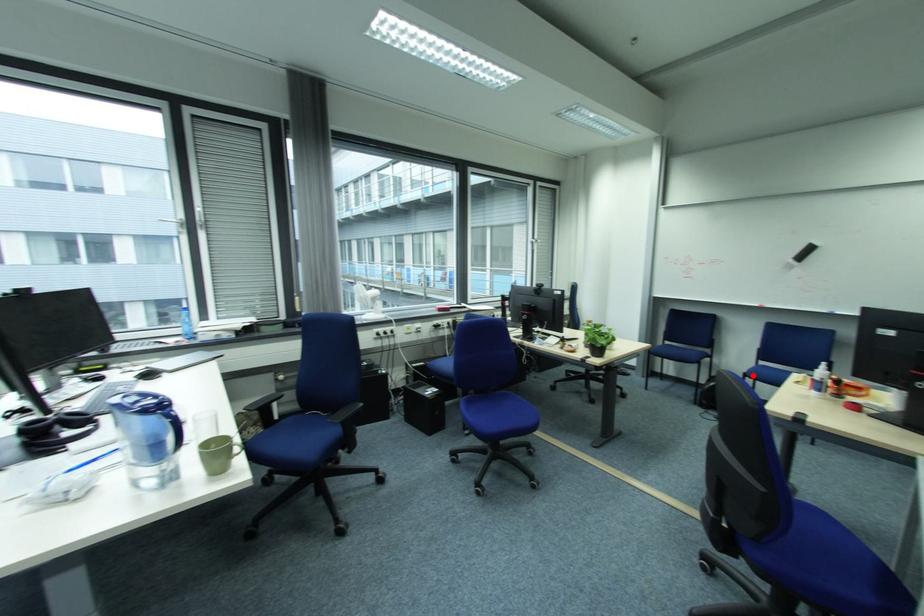
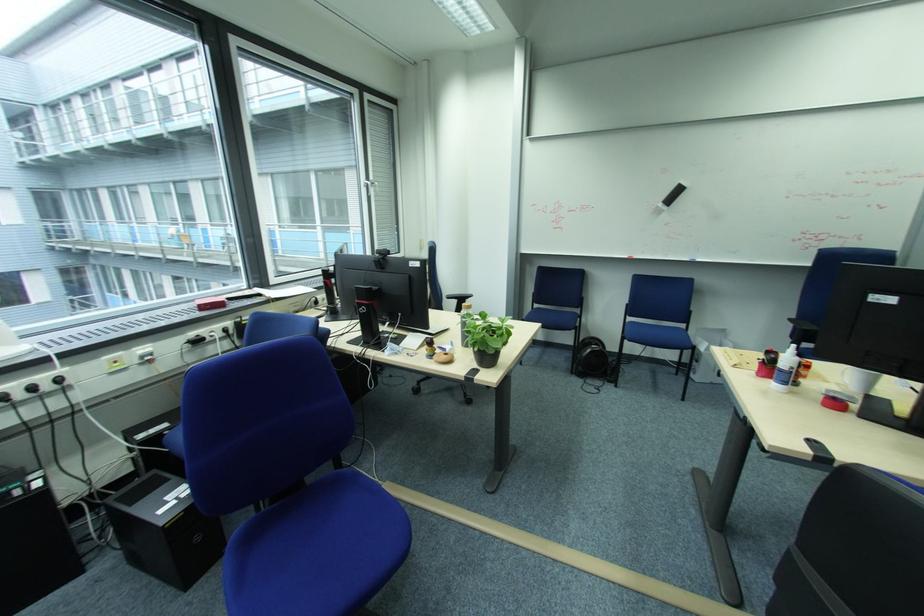
The point at the highlighted location is marked in the first image. Where is the corresponding point in the second image?

(633, 339)